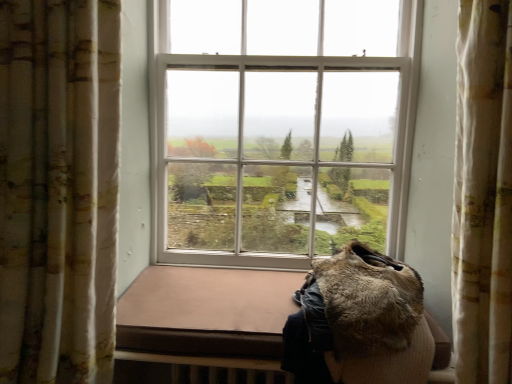
Locate an element on the screen. blank area to the left of furry brown coat at lower right is located at coordinates (225, 310).